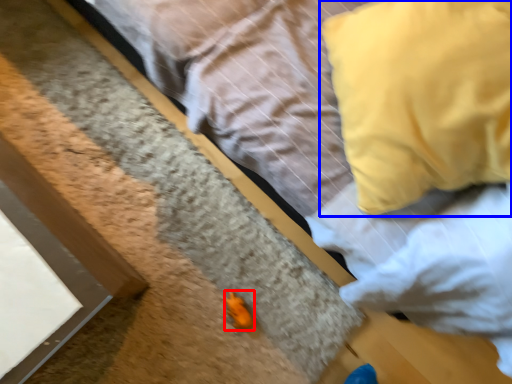
Question: Among these objects, which one is farthest to the camera, miniature (highlighted by a red box) or pillow (highlighted by a blue box)?

Choices:
 (A) miniature
 (B) pillow

Answer: (A)